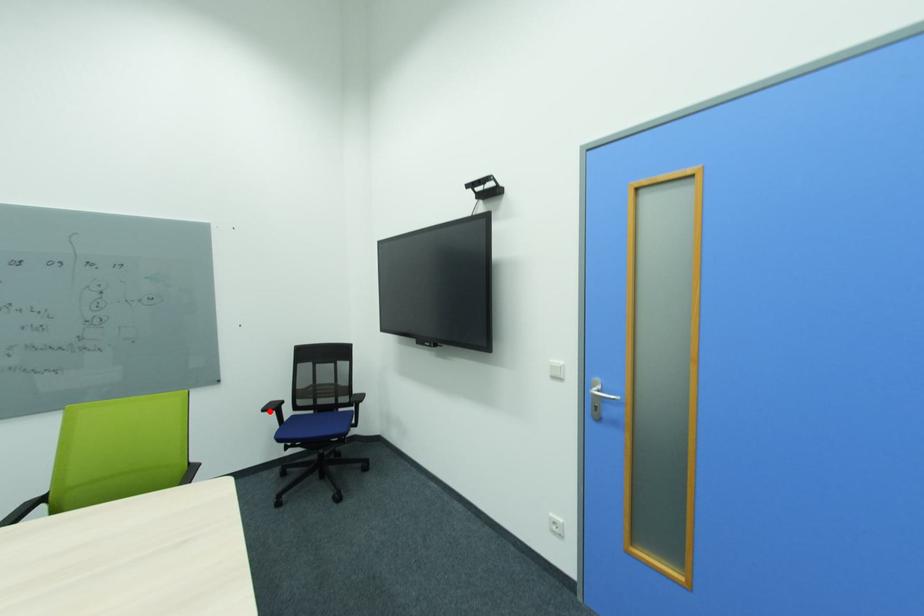
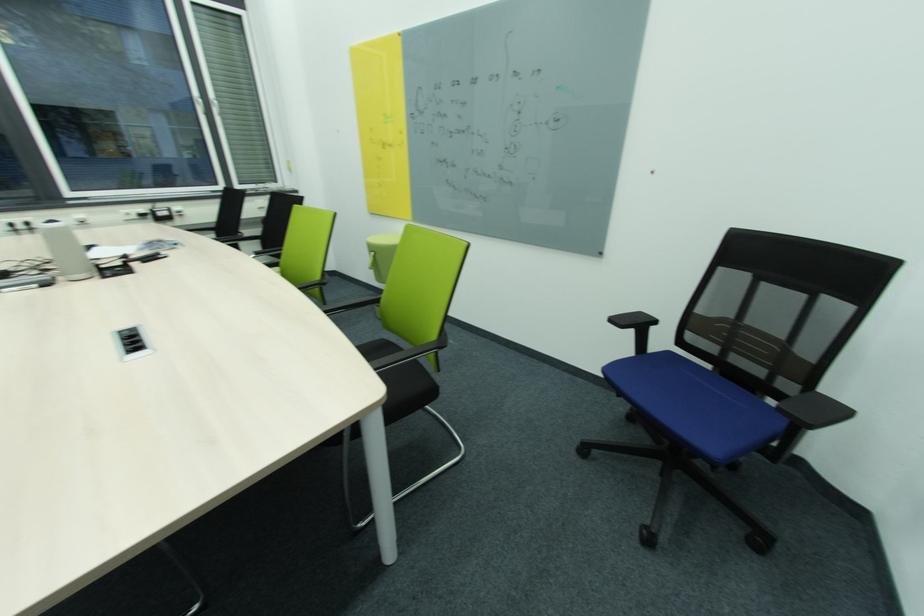
In the second image, find the point that corresponds to the highlighted location in the first image.

(617, 321)